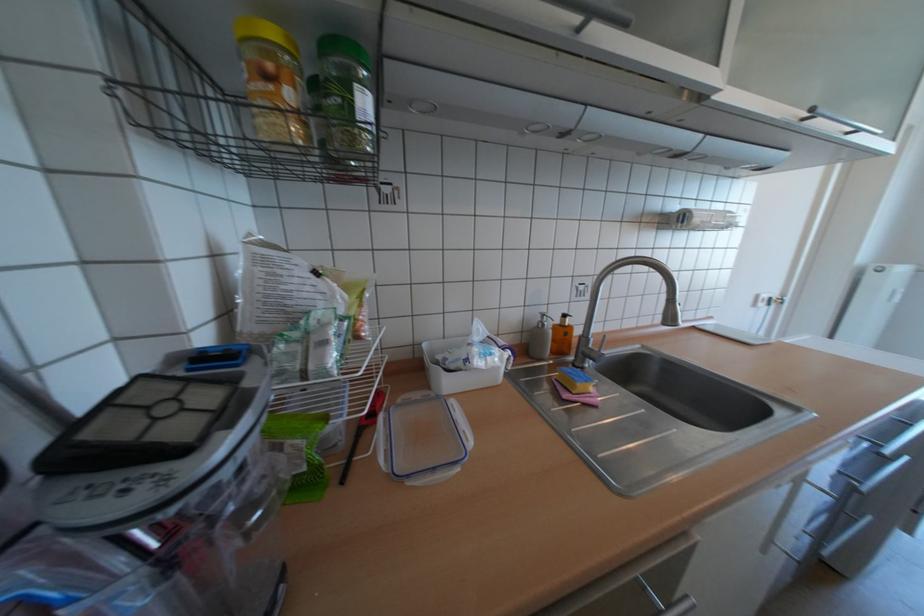
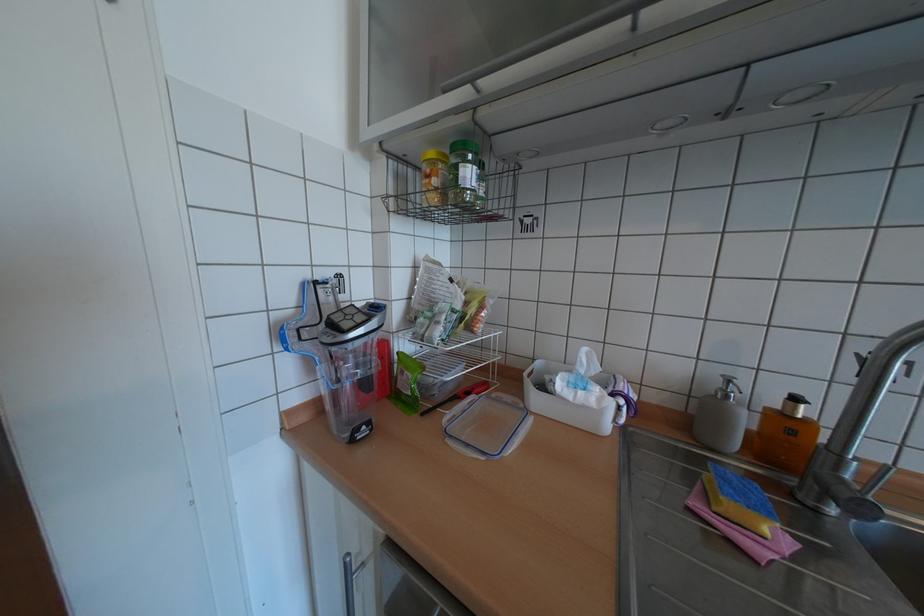
Find the pixel in the second image that matches point (574, 315) in the first image.

(805, 399)